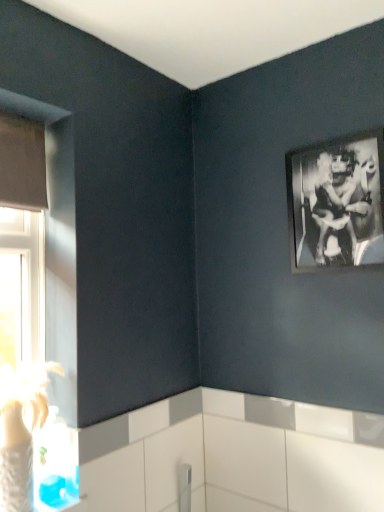
Question: From a real-world perspective, is black matte picture frame at upper right positioned above or below matte gray window at left?

Choices:
 (A) below
 (B) above

Answer: (B)

Question: From the image's perspective, is black matte picture frame at upper right positioned above or below matte gray window at left?

Choices:
 (A) below
 (B) above

Answer: (B)

Question: Do you think black matte picture frame at upper right is within matte gray window at left, or outside of it?

Choices:
 (A) outside
 (B) inside

Answer: (A)

Question: Considering the positions of matte gray window at left and black matte picture frame at upper right in the image, is matte gray window at left taller or shorter than black matte picture frame at upper right?

Choices:
 (A) tall
 (B) short

Answer: (A)

Question: Is matte gray window at left in front of or behind black matte picture frame at upper right in the image?

Choices:
 (A) behind
 (B) front

Answer: (B)

Question: Do you think matte gray window at left is within black matte picture frame at upper right, or outside of it?

Choices:
 (A) inside
 (B) outside

Answer: (B)

Question: Is matte gray window at left bigger or smaller than black matte picture frame at upper right?

Choices:
 (A) big
 (B) small

Answer: (A)